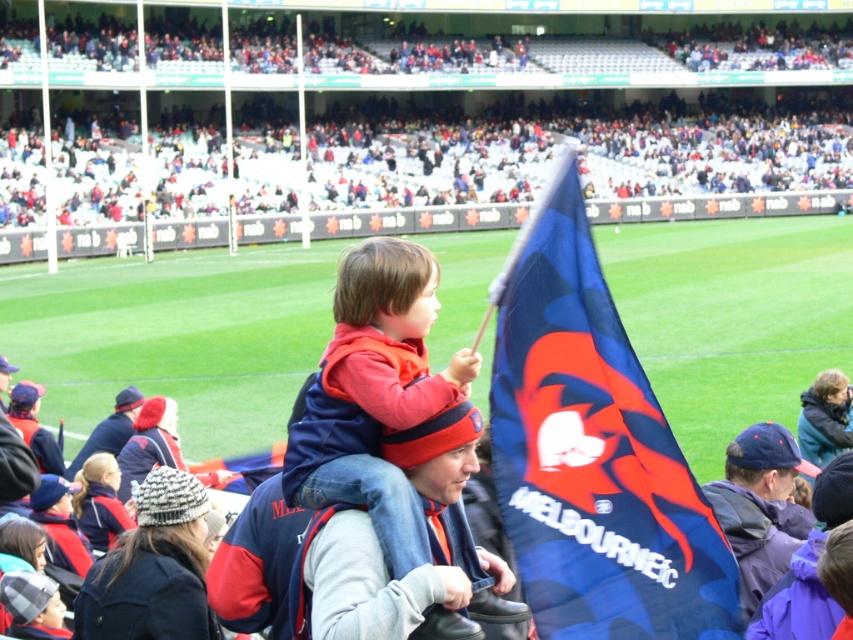
You are a photographer at the stadium and want to take a photo of the red fleece jacket at center and the dark blue jacket at center. Which jacket should you focus on first to ensure it appears larger in the photo?

The red fleece jacket at center is bigger than the dark blue jacket at center, so you should focus on the red fleece jacket at center first to ensure it appears larger in the photo.

From the picture: You are a photographer standing at the center of the stadium. You want to take a photo of the blue fabric flag at center. Which direction should you move to get the best shot?

The blue fabric flag at center is already at the center of the stadium, so you don